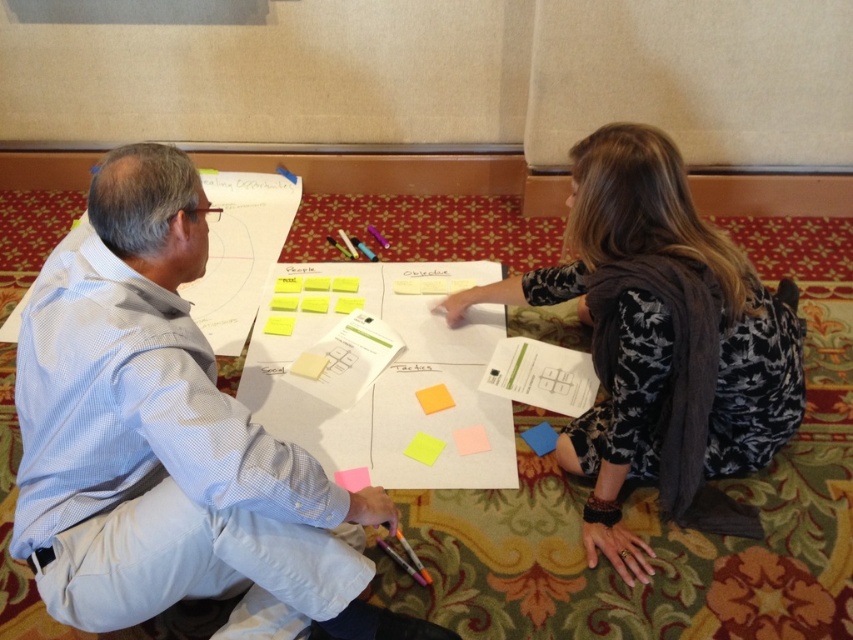
Can you confirm if light blue shirt at left is thinner than white paper at center?

Incorrect, light blue shirt at left's width is not less than white paper at center's.

Does light blue shirt at left appear over white paper at center?

No, light blue shirt at left is not above white paper at center.

Image resolution: width=853 pixels, height=640 pixels. Identify the location of light blue shirt at left. (167, 440).

Who is positioned more to the right, light blue shirt at left or yellow paper at center?

Positioned to the right is yellow paper at center.

This screenshot has height=640, width=853. Find the location of `light blue shirt at left`. light blue shirt at left is located at coordinates (167, 440).

From the picture: Who is shorter, light yellow sticky note at center or yellow sticky note at center?

With less height is light yellow sticky note at center.

Who is taller, light yellow sticky note at center or yellow sticky note at center?

yellow sticky note at center

Is point (459, 448) positioned before point (305, 365)?

Yes, point (459, 448) is in front of point (305, 365).

Locate an element on the screen. The image size is (853, 640). light yellow sticky note at center is located at coordinates (469, 440).